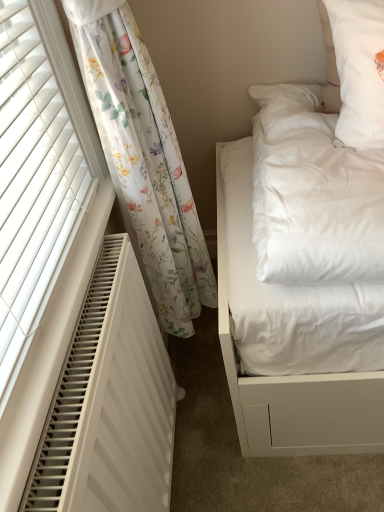
I want to click on floral sheer curtain at left, so tap(144, 159).

In order to face floral sheer curtain at left, should I rotate leftwards or rightwards?

To face it directly, rotate left by 4.383 degrees.

Describe the element at coordinates (144, 159) in the screenshot. I see `floral sheer curtain at left` at that location.

Find the location of `white textured radiator at left`. white textured radiator at left is located at coordinates (109, 403).

What is the approximate width of white textured radiator at left?

white textured radiator at left is 8.23 centimeters in width.

The width and height of the screenshot is (384, 512). What do you see at coordinates (109, 403) in the screenshot?
I see `white textured radiator at left` at bounding box center [109, 403].

I want to click on floral sheer curtain at left, so click(144, 159).

Which is more to the right, floral sheer curtain at left or white textured radiator at left?

floral sheer curtain at left.

Is the position of floral sheer curtain at left less distant than that of white textured radiator at left?

No, floral sheer curtain at left is further to the viewer.

Which point is more forward, (190, 334) or (107, 286)?

Positioned in front is point (107, 286).

From the image's perspective, is floral sheer curtain at left beneath white textured radiator at left?

Incorrect, from the image's perspective, floral sheer curtain at left is higher than white textured radiator at left.

From a real-world perspective, who is located lower, floral sheer curtain at left or white textured radiator at left?

white textured radiator at left.

Between floral sheer curtain at left and white textured radiator at left, which one has larger width?

floral sheer curtain at left is wider.

Between floral sheer curtain at left and white textured radiator at left, which one has more height?

floral sheer curtain at left.

Considering the relative sizes of floral sheer curtain at left and white textured radiator at left in the image provided, is floral sheer curtain at left bigger than white textured radiator at left?

Indeed, floral sheer curtain at left has a larger size compared to white textured radiator at left.

Is white textured radiator at left surrounded by floral sheer curtain at left?

No.

Is floral sheer curtain at left with white textured radiator at left?

There is a gap between floral sheer curtain at left and white textured radiator at left.

Could you tell me if floral sheer curtain at left is turned towards white textured radiator at left?

No.

Measure the distance between floral sheer curtain at left and white textured radiator at left.

10.76 inches.

You are a GUI agent. You are given a task and a screenshot of the screen. Output one action in this format:
    pyautogui.click(x=<x>, y=<y>)
    Task: Click on the air conditioner on the left of the floral sheer curtain at left
    Image resolution: width=384 pixels, height=512 pixels.
    Given the screenshot: What is the action you would take?
    pyautogui.click(x=109, y=403)

In the image, is white textured radiator at left on the left side or the right side of floral sheer curtain at left?

From the image, it's evident that white textured radiator at left is to the left of floral sheer curtain at left.

Is white textured radiator at left in front of or behind floral sheer curtain at left in the image?

In the image, white textured radiator at left appears in front of floral sheer curtain at left.

Does point (110, 317) appear closer or farther from the camera than point (124, 128)?

Point (110, 317) is closer to the camera than point (124, 128).

From the image's perspective, is white textured radiator at left located beneath floral sheer curtain at left?

Indeed, from the image's perspective, white textured radiator at left is shown beneath floral sheer curtain at left.

From a real-world perspective, is white textured radiator at left beneath floral sheer curtain at left?

Yes, from a real-world perspective, white textured radiator at left is beneath floral sheer curtain at left.

Considering the sizes of objects white textured radiator at left and floral sheer curtain at left in the image provided, who is wider, white textured radiator at left or floral sheer curtain at left?

floral sheer curtain at left is wider.

In terms of height, does white textured radiator at left look taller or shorter compared to floral sheer curtain at left?

Considering their sizes, white textured radiator at left has less height than floral sheer curtain at left.

Is white textured radiator at left bigger than floral sheer curtain at left?

Actually, white textured radiator at left might be smaller than floral sheer curtain at left.

Is white textured radiator at left completely or partially outside of floral sheer curtain at left?

white textured radiator at left is positioned outside floral sheer curtain at left.

Are white textured radiator at left and floral sheer curtain at left making contact?

white textured radiator at left and floral sheer curtain at left are not in contact.

Could you tell me if white textured radiator at left is facing floral sheer curtain at left?

No, white textured radiator at left is not facing towards floral sheer curtain at left.

What's the angular difference between white textured radiator at left and floral sheer curtain at left's facing directions?

The angular difference between white textured radiator at left and floral sheer curtain at left is 1.33 degrees.

Identify the location of curtain on the right of white textured radiator at left. This screenshot has width=384, height=512. (144, 159).

Identify the location of curtain located behind the white textured radiator at left. (144, 159).

This screenshot has width=384, height=512. I want to click on curtain lying on the right of white textured radiator at left, so click(x=144, y=159).